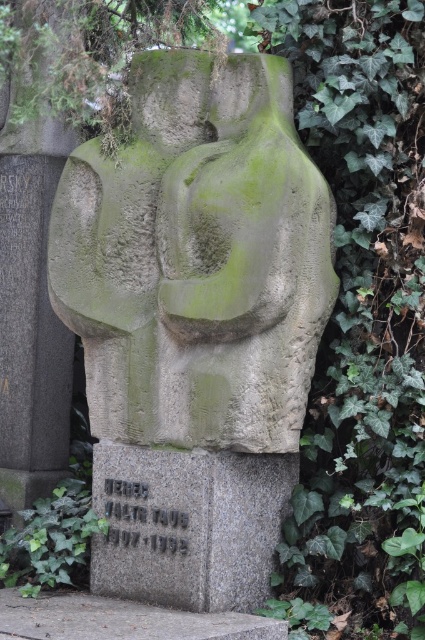
Does green ivy at center have a lesser width compared to granite stone at center?

Yes, green ivy at center is thinner than granite stone at center.

Based on the photo, does green ivy at center appear on the left side of granite stone at center?

In fact, green ivy at center is to the right of granite stone at center.

The image size is (425, 640). Find the location of `green ivy at center`. green ivy at center is located at coordinates (362, 317).

Between point (198, 372) and point (340, 428), which one is positioned behind?

The point (340, 428) is more distant.

At what (x,y) coordinates should I click in order to perform the action: click on green mossy stone sculpture at center. Please return your answer as a coordinate pair (x, y). The height and width of the screenshot is (640, 425). Looking at the image, I should click on (197, 259).

What are the coordinates of `green mossy stone sculpture at center` in the screenshot? It's located at (197, 259).

Who is more forward, (189, 465) or (14, 573)?

Point (189, 465)

Does granite stone at center have a lesser height compared to green mossy stone at lower left?

No.

Who is more forward, (129, 573) or (10, 584)?

Point (129, 573) is more forward.

Where is `granite stone at center`? The height and width of the screenshot is (640, 425). granite stone at center is located at coordinates point(187,524).